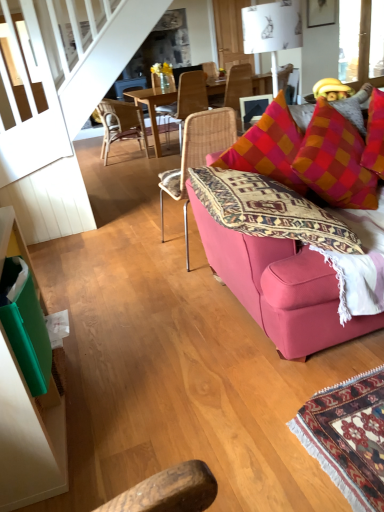
Question: Considering the relative positions of white paper lampshade at upper center and woven rattan chair at center, which is counted as the 3th chair, starting from the back, in the image provided, is white paper lampshade at upper center to the right of woven rattan chair at center, which is counted as the 3th chair, starting from the back, from the viewer's perspective?

Choices:
 (A) no
 (B) yes

Answer: (B)

Question: Is white paper lampshade at upper center positioned before woven rattan chair at center, which appears as the 2th chair when viewed from the front?

Choices:
 (A) no
 (B) yes

Answer: (B)

Question: From a real-world perspective, is white paper lampshade at upper center beneath woven rattan chair at center, which is counted as the 3th chair, starting from the back?

Choices:
 (A) no
 (B) yes

Answer: (A)

Question: From the image's perspective, does white paper lampshade at upper center appear higher than woven rattan chair at center, which appears as the 2th chair when viewed from the front?

Choices:
 (A) no
 (B) yes

Answer: (A)

Question: From a real-world perspective, is white paper lampshade at upper center on top of woven rattan chair at center, which appears as the 2th chair when viewed from the front?

Choices:
 (A) no
 (B) yes

Answer: (B)

Question: Does white paper lampshade at upper center have a greater width compared to woven rattan chair at center, which is counted as the 3th chair, starting from the back?

Choices:
 (A) yes
 (B) no

Answer: (B)

Question: Can you confirm if pink fabric couch at right is shorter than woven rattan chair at center, which is counted as the 3th chair, starting from the back?

Choices:
 (A) yes
 (B) no

Answer: (A)

Question: Is pink fabric couch at right at the right side of woven rattan chair at center, which is counted as the 3th chair, starting from the back?

Choices:
 (A) yes
 (B) no

Answer: (A)

Question: Is pink fabric couch at right wider than woven rattan chair at center, which is counted as the 3th chair, starting from the back?

Choices:
 (A) no
 (B) yes

Answer: (A)

Question: From the image's perspective, would you say pink fabric couch at right is positioned over woven rattan chair at center, which appears as the 2th chair when viewed from the front?

Choices:
 (A) no
 (B) yes

Answer: (A)

Question: From a real-world perspective, is pink fabric couch at right positioned over woven rattan chair at center, which is counted as the 3th chair, starting from the back, based on gravity?

Choices:
 (A) no
 (B) yes

Answer: (B)

Question: Could you tell me if pink fabric couch at right is turned towards woven rattan chair at center, which appears as the 2th chair when viewed from the front?

Choices:
 (A) yes
 (B) no

Answer: (B)

Question: Is woven rattan chair at center, which appears as the 2th chair when viewed from the front, at the right side of white paper lampshade at upper center?

Choices:
 (A) yes
 (B) no

Answer: (B)